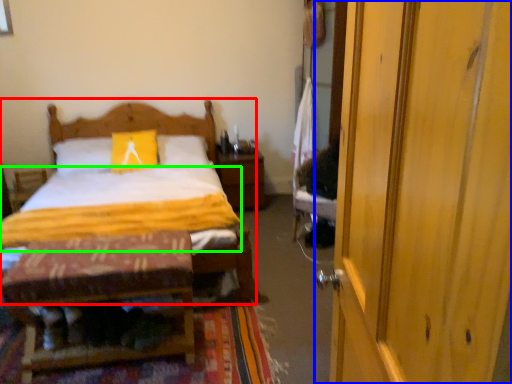
Question: Considering the real-world distances, which object is closest to bed (highlighted by a red box)? door (highlighted by a blue box) or quilt (highlighted by a green box).

Choices:
 (A) door
 (B) quilt

Answer: (B)